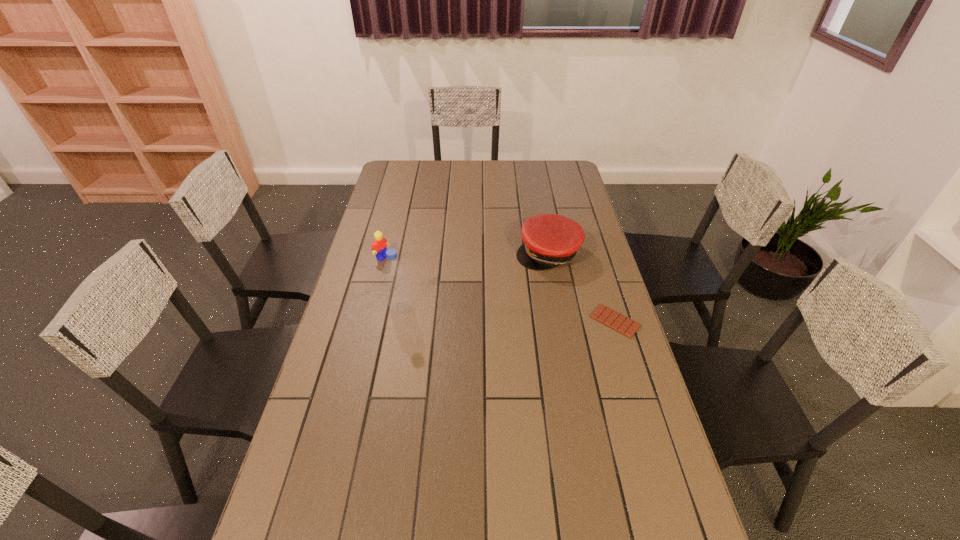
Image resolution: width=960 pixels, height=540 pixels. I want to click on vacant space situated 0.400m on the front-facing side of the leftmost object, so click(x=471, y=309).

Locate an element on the screen. Image resolution: width=960 pixels, height=540 pixels. vacant space situated 0.050m on the front-facing side of the leftmost object is located at coordinates (396, 266).

In order to click on vacant space located 0.180m on the front-facing side of the leftmost object in this screenshot , I will do `click(422, 281)`.

Identify the location of bottle present at the left edge. The width and height of the screenshot is (960, 540). (397, 289).

The image size is (960, 540). I want to click on Lego that is at the left edge, so click(379, 245).

What are the coordinates of `candy bar at the right edge` in the screenshot? It's located at (603, 314).

In order to click on cap that is at the right edge in this screenshot , I will do `click(550, 240)`.

You are a GUI agent. You are given a task and a screenshot of the screen. Output one action in this format:
    pyautogui.click(x=<x>, y=<y>)
    Task: Click on the vacant space at the far edge
    The width and height of the screenshot is (960, 540).
    Given the screenshot: What is the action you would take?
    pyautogui.click(x=443, y=163)

Identify the location of vacant space at the near edge. This screenshot has width=960, height=540. (488, 519).

At what (x,y) coordinates should I click in order to perform the action: click on vacant space at the left edge of the desktop. Please return your answer as a coordinate pair (x, y). Looking at the image, I should click on (379, 335).